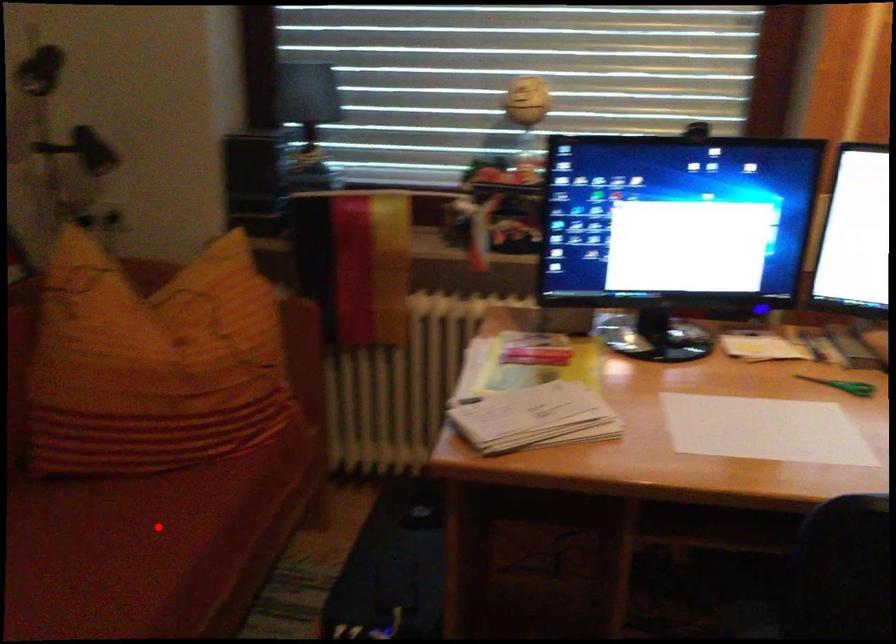
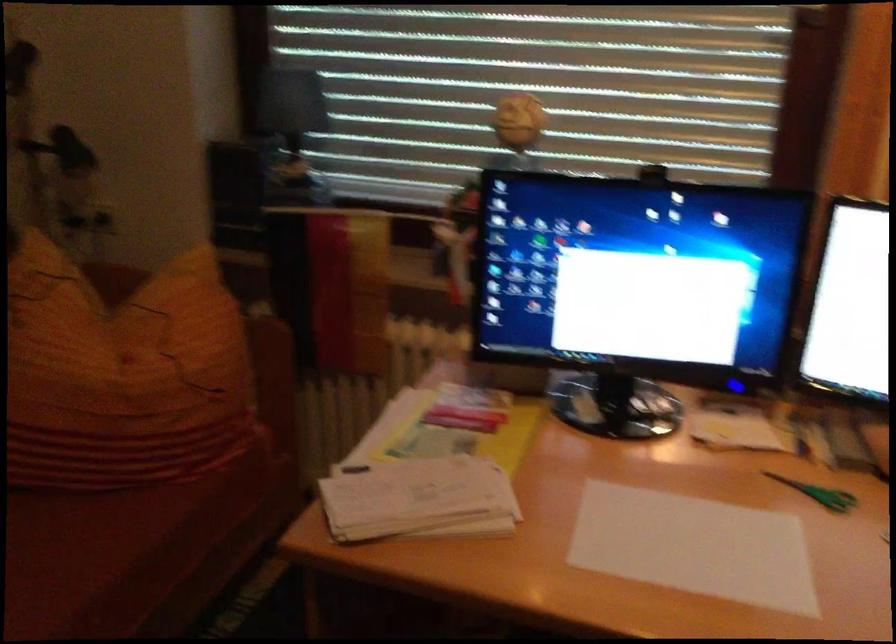
Find the pixel in the second image that matches the highlighted location in the first image.

(66, 556)